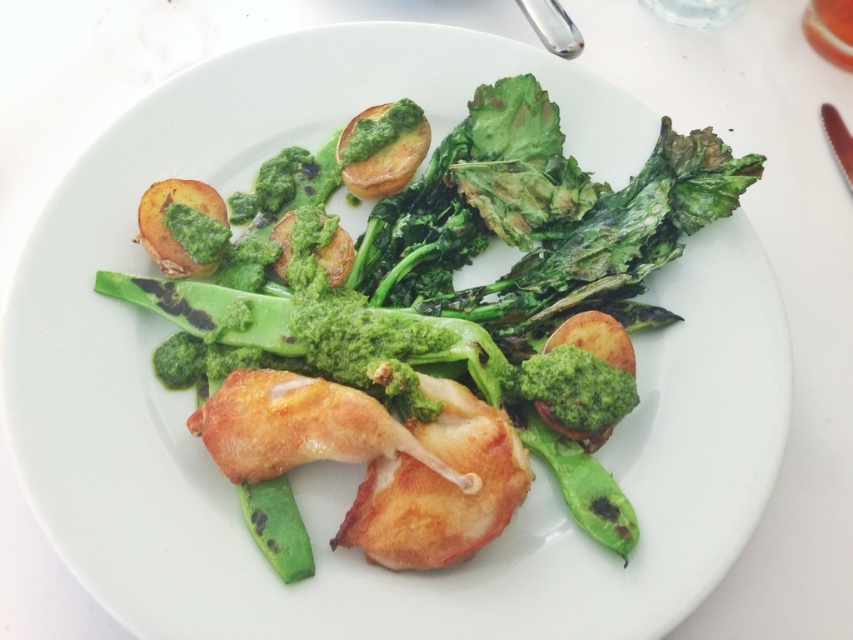
Question: Among these objects, which one is nearest to the camera?

Choices:
 (A) matte golden-brown potato at upper left
 (B) green smooth broccoli at center

Answer: (B)

Question: Can you confirm if green smooth broccoli at center is positioned to the left of matte golden-brown potato at upper left?

Choices:
 (A) no
 (B) yes

Answer: (A)

Question: From the image, what is the correct spatial relationship of green smooth broccoli at center in relation to matte golden-brown potato at upper left?

Choices:
 (A) below
 (B) above

Answer: (A)

Question: Does green smooth broccoli at center have a smaller size compared to matte golden-brown potato at upper left?

Choices:
 (A) no
 (B) yes

Answer: (A)

Question: Which object appears closest to the camera in this image?

Choices:
 (A) green smooth broccoli at center
 (B) matte golden-brown potato at upper left

Answer: (A)